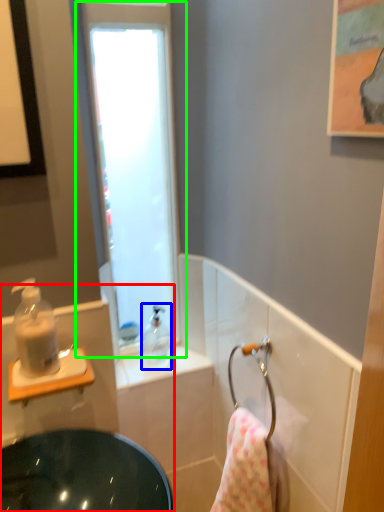
Question: Which object is positioned closest to sink (highlighted by a red box)? Select from soap dispenser (highlighted by a blue box) and window (highlighted by a green box).

Choices:
 (A) soap dispenser
 (B) window

Answer: (A)